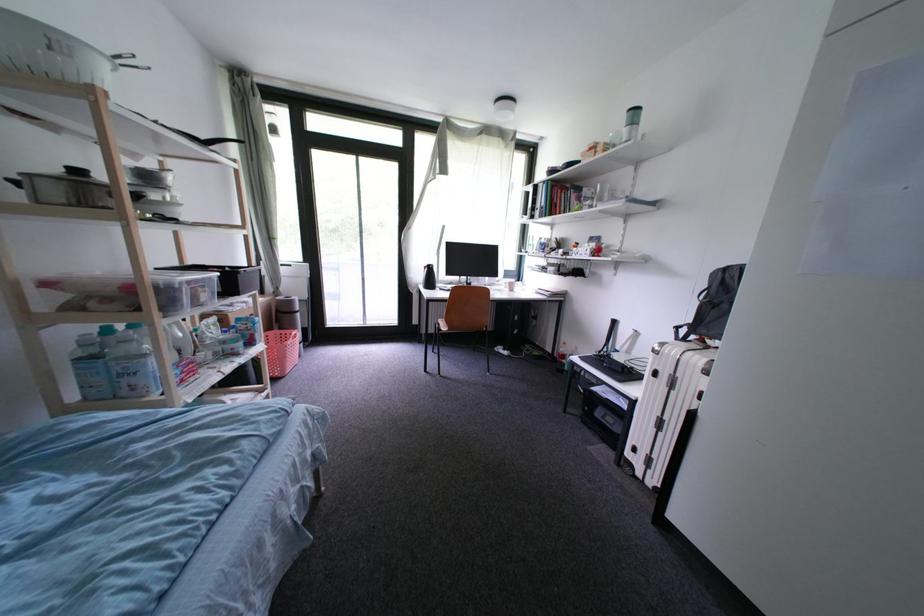
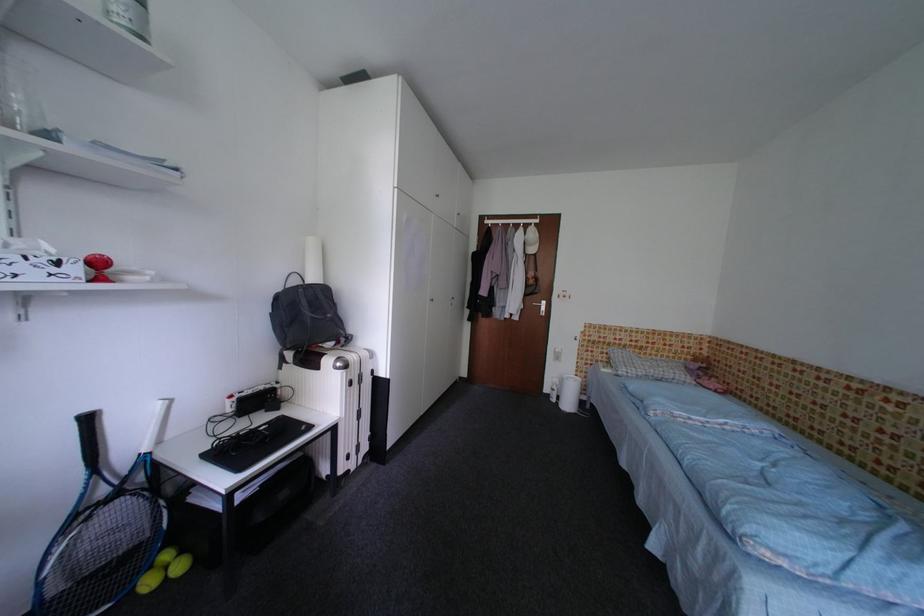
Locate, in the second image, the point that corresponds to (623,325) in the first image.

(98, 422)